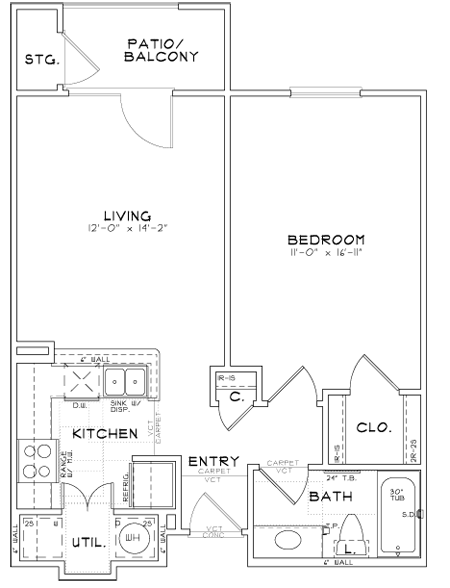
Locate an element on the screen. door is located at coordinates (151, 109), (69, 66), (290, 384), (373, 376), (238, 414), (282, 486), (214, 516), (105, 497), (71, 497).